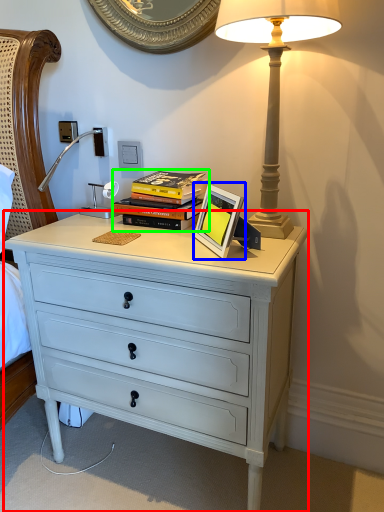
Question: Based on their relative distances, which object is farther from chest of drawers (highlighted by a red box)? Choose from picture frame (highlighted by a blue box) and book (highlighted by a green box).

Choices:
 (A) picture frame
 (B) book

Answer: (B)